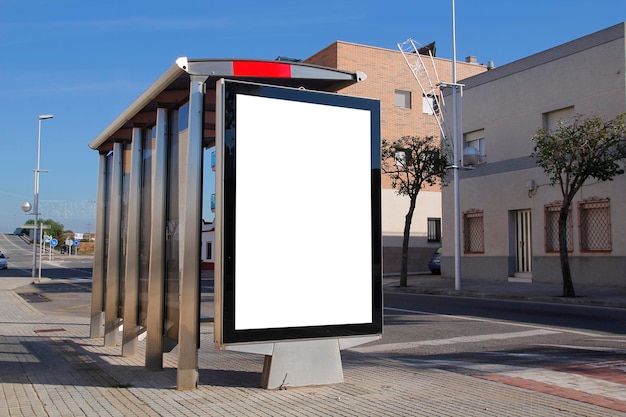
Find the location of a particular element. screen is located at coordinates (310, 245).